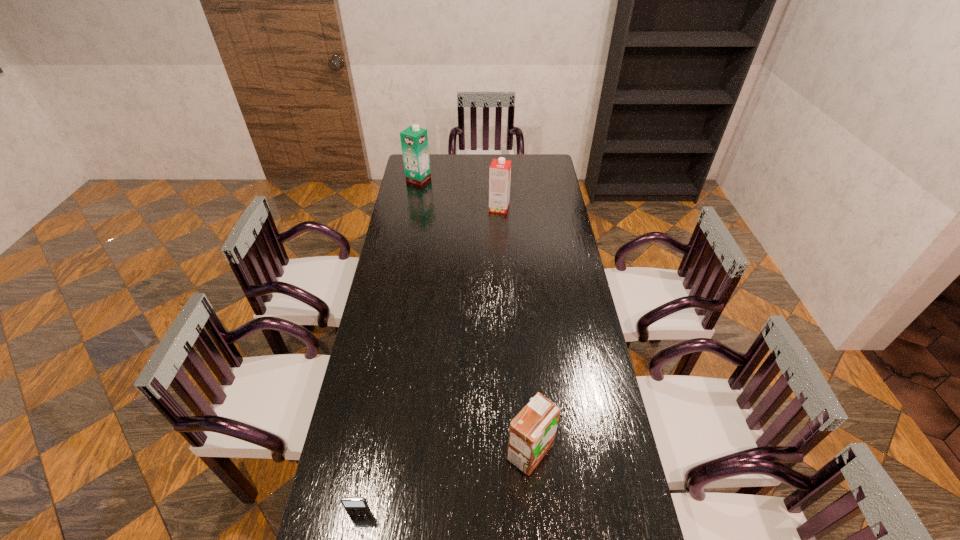
The height and width of the screenshot is (540, 960). Identify the location of the leftmost carton. (414, 140).

Image resolution: width=960 pixels, height=540 pixels. Find the location of `the farthest object`. the farthest object is located at coordinates (414, 140).

Where is `the second farthest carton`? the second farthest carton is located at coordinates (500, 169).

Identify the location of the third farthest object. (532, 431).

Locate an element on the screen. This screenshot has height=540, width=960. the second shortest object is located at coordinates (532, 431).

Where is `the nearest object`? The image size is (960, 540). the nearest object is located at coordinates (353, 505).

This screenshot has width=960, height=540. Find the location of `the shortest object`. the shortest object is located at coordinates (353, 505).

I want to click on vacant space located 0.110m on the right of the farthest carton, so click(451, 179).

The width and height of the screenshot is (960, 540). Find the location of `free space located on the front of the second farthest object`. free space located on the front of the second farthest object is located at coordinates point(502,261).

Find the location of a particular element. This screenshot has height=540, width=960. vacant space located 0.260m on the straw side of the third farthest object is located at coordinates (418, 452).